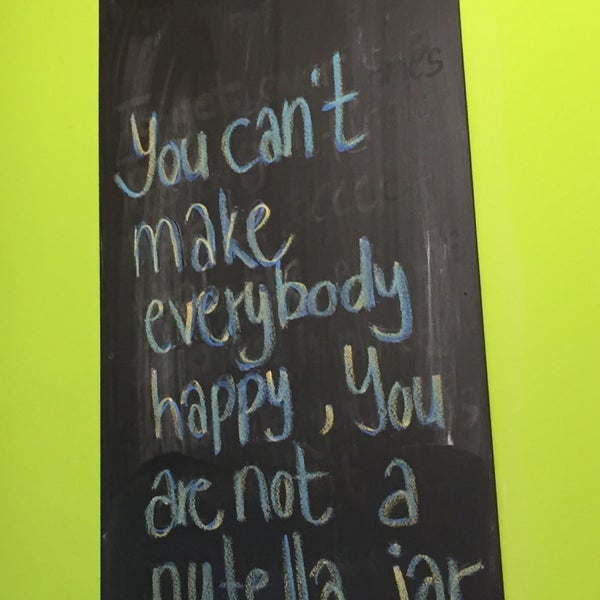
Image resolution: width=600 pixels, height=600 pixels. Find the location of `chalk board`. chalk board is located at coordinates (338, 346).